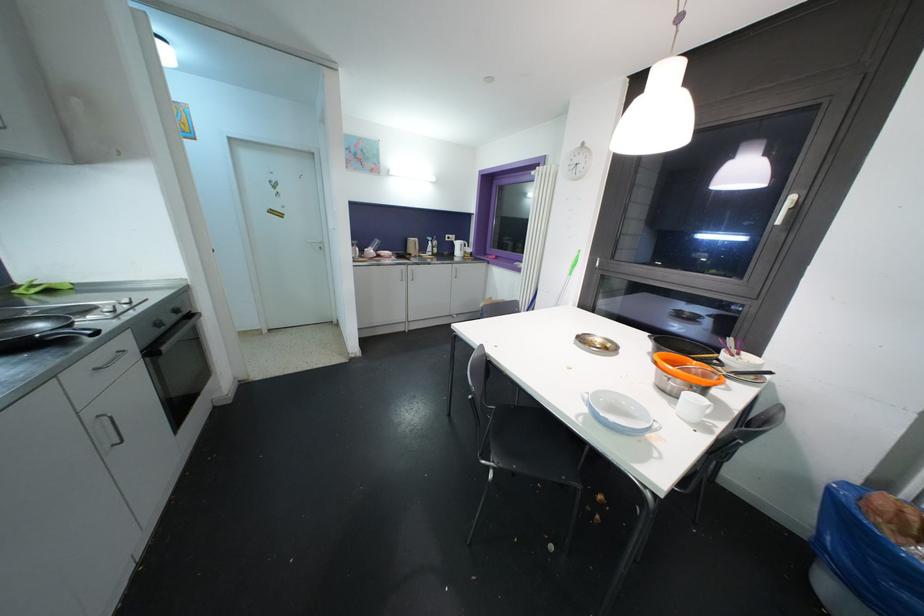
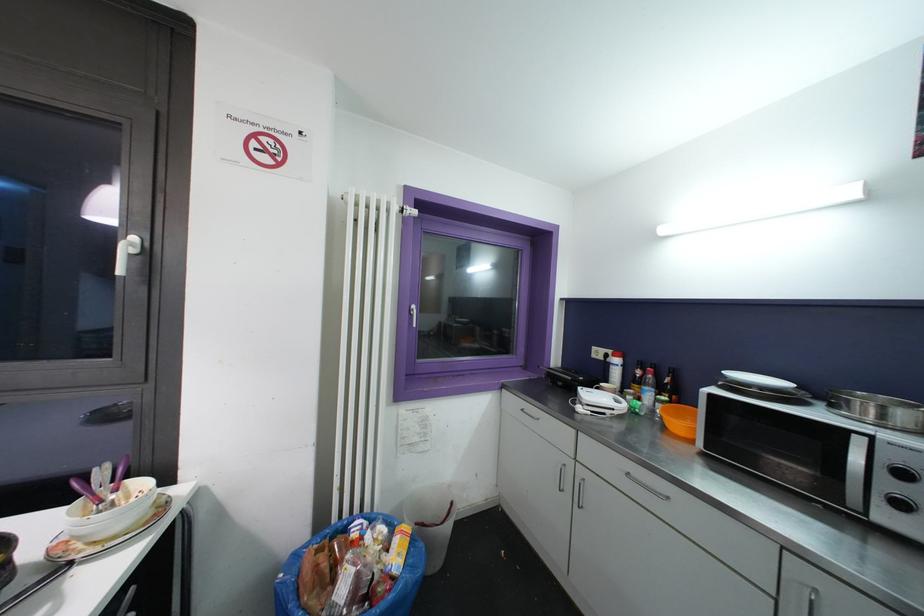
The point at (746, 355) is marked in the first image. Where is the corresponding point in the second image?

(131, 484)